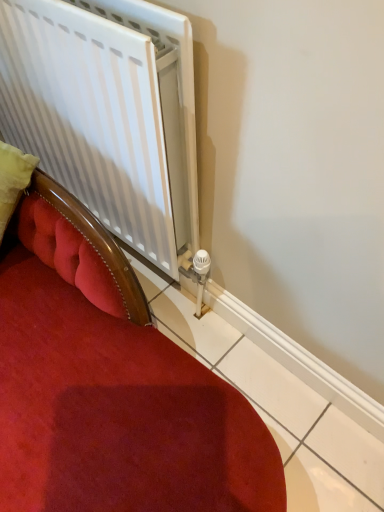
In order to click on white plastic radiator at upper left in this screenshot , I will do (107, 113).

Describe the element at coordinates (107, 113) in the screenshot. I see `white plastic radiator at upper left` at that location.

Where is `white plastic radiator at upper left`? The image size is (384, 512). white plastic radiator at upper left is located at coordinates (107, 113).